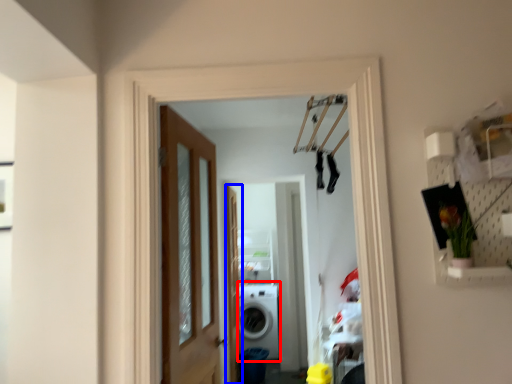
Question: Which object appears closest to the camera in this image, washing machine (highlighted by a red box) or screen door (highlighted by a blue box)?

Choices:
 (A) washing machine
 (B) screen door

Answer: (B)